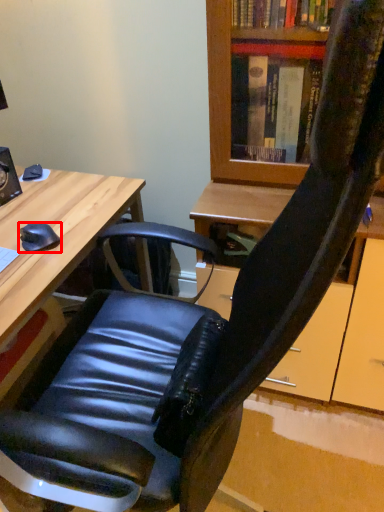
Question: From the image's perspective, where is mouse (annotated by the red box) located in relation to desk in the image?

Choices:
 (A) below
 (B) above

Answer: (B)